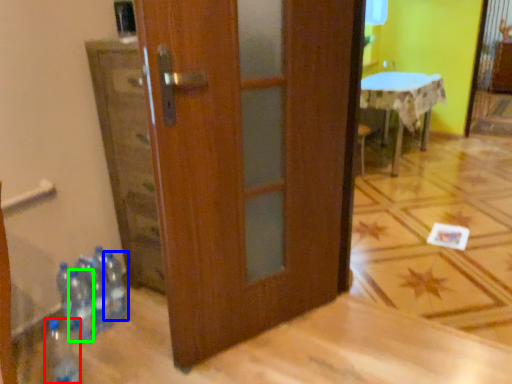
Question: Based on their relative distances, which object is nearer to bottle (highlighted by a red box)? Choose from bottle (highlighted by a blue box) and bottle (highlighted by a green box).

Choices:
 (A) bottle
 (B) bottle

Answer: (B)